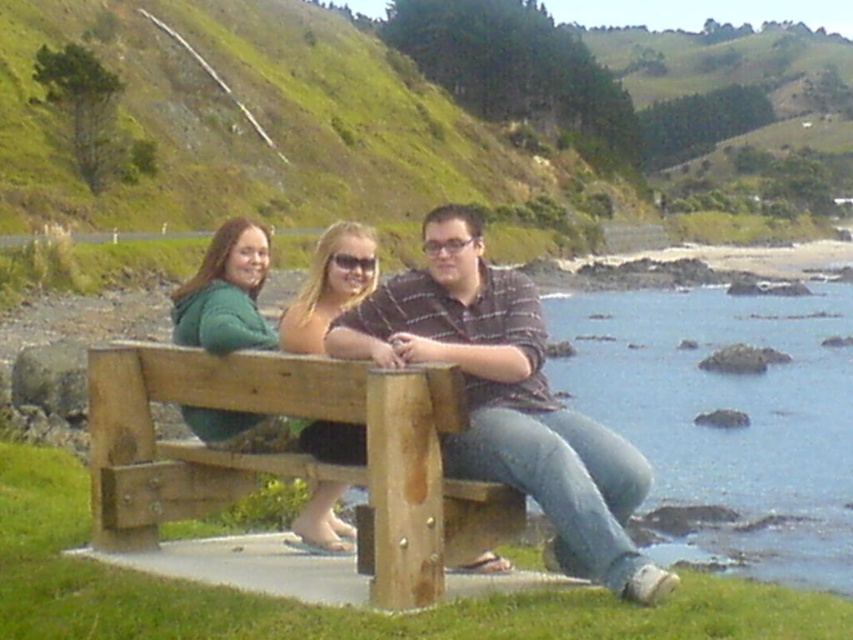
Can you confirm if wooden bench at center is smaller than matte black dress at center?

Incorrect, wooden bench at center is not smaller in size than matte black dress at center.

This screenshot has height=640, width=853. What do you see at coordinates (292, 454) in the screenshot?
I see `wooden bench at center` at bounding box center [292, 454].

Which is behind, point (141, 410) or point (341, 522)?

The point (341, 522) is more distant.

The height and width of the screenshot is (640, 853). What are the coordinates of `wooden bench at center` in the screenshot? It's located at (292, 454).

Is green grassy hillside at upper center smaller than green fleece jacket at left?

No.

Can you confirm if green grassy hillside at upper center is shorter than green fleece jacket at left?

No.

Where is `green grassy hillside at upper center`? Image resolution: width=853 pixels, height=640 pixels. green grassy hillside at upper center is located at coordinates (248, 122).

Is green grassy hillside at upper center shorter than wooden bench at center?

No.

Is green grassy hillside at upper center positioned in front of wooden bench at center?

No, it is not.

Does point (251, 81) come closer to viewer compared to point (396, 440)?

No, it is not.

Identify the location of green grassy hillside at upper center. The image size is (853, 640). [x=248, y=122].